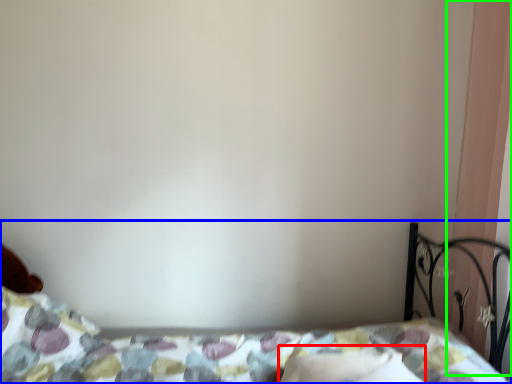
Question: Which is nearer to the pillow (highlighted by a red box)? bed (highlighted by a blue box) or curtain (highlighted by a green box).

Choices:
 (A) bed
 (B) curtain

Answer: (A)